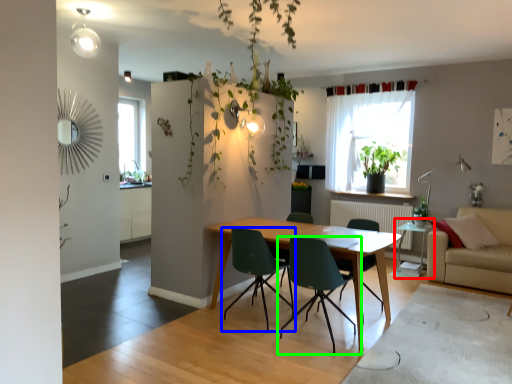
Question: Which object is the farthest from side table (highlighted by a red box)? Choose among these: chair (highlighted by a blue box) or chair (highlighted by a green box).

Choices:
 (A) chair
 (B) chair

Answer: (A)